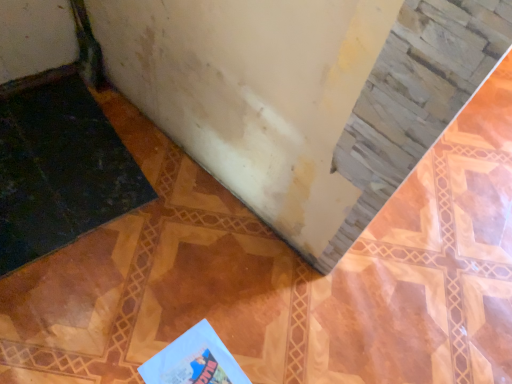
Where is `free space above black rubber doormat at lower left (from a real-world perspective)`? The height and width of the screenshot is (384, 512). free space above black rubber doormat at lower left (from a real-world perspective) is located at coordinates (54, 163).